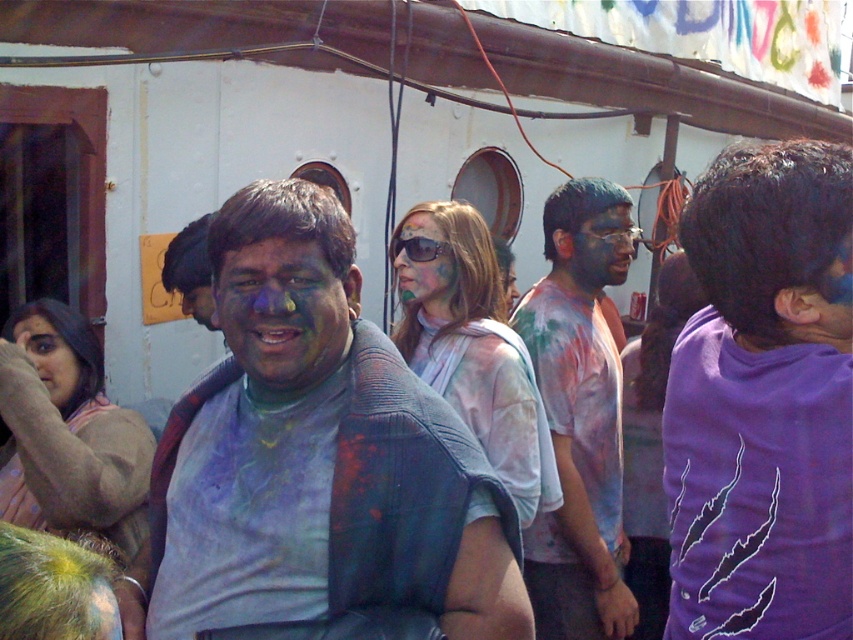
In the Holi celebration scene, there are two central figures at the center. You see a matte blue shirt at center and a matte skin at center. Which one is positioned more to the right?

The matte blue shirt at center is to the right of matte skin at center, so the matte blue shirt at center is positioned more to the right.

You are a photographer trying to capture the central figure in the Holi celebration. You notice the matte plastic sunglasses at center. Where exactly should you position your camera to ensure the sunglasses are in the frame?

The matte plastic sunglasses at center are located at point (424, 266), so position your camera to focus on that coordinate to include them in the frame.